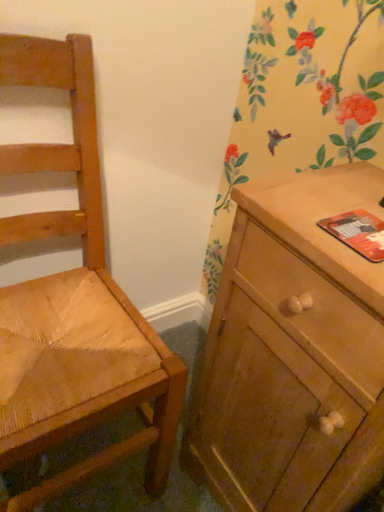
Question: Is orange matte paperback book at right directly adjacent to light brown woven wood chair at left?

Choices:
 (A) yes
 (B) no

Answer: (B)

Question: Does orange matte paperback book at right turn towards light brown woven wood chair at left?

Choices:
 (A) no
 (B) yes

Answer: (A)

Question: Can you confirm if orange matte paperback book at right is positioned to the left of light brown woven wood chair at left?

Choices:
 (A) no
 (B) yes

Answer: (A)

Question: Does orange matte paperback book at right have a greater height compared to light brown woven wood chair at left?

Choices:
 (A) no
 (B) yes

Answer: (A)

Question: Is orange matte paperback book at right not near light brown woven wood chair at left?

Choices:
 (A) no
 (B) yes

Answer: (A)

Question: Looking at their shapes, would you say wooden cabinet at right is wider or thinner than light brown woven wood chair at left?

Choices:
 (A) wide
 (B) thin

Answer: (B)

Question: Considering the relative positions of wooden cabinet at right and light brown woven wood chair at left in the image provided, is wooden cabinet at right to the left or to the right of light brown woven wood chair at left?

Choices:
 (A) left
 (B) right

Answer: (B)

Question: In terms of height, does wooden cabinet at right look taller or shorter compared to light brown woven wood chair at left?

Choices:
 (A) short
 (B) tall

Answer: (A)

Question: Does point (342, 453) appear closer or farther from the camera than point (100, 207)?

Choices:
 (A) farther
 (B) closer

Answer: (B)

Question: Is light brown woven wood chair at left wider or thinner than orange matte paperback book at right?

Choices:
 (A) thin
 (B) wide

Answer: (B)

Question: From a real-world perspective, is light brown woven wood chair at left physically located above or below orange matte paperback book at right?

Choices:
 (A) above
 (B) below

Answer: (B)

Question: Which is correct: light brown woven wood chair at left is inside orange matte paperback book at right, or outside of it?

Choices:
 (A) inside
 (B) outside

Answer: (B)

Question: Relative to orange matte paperback book at right, is light brown woven wood chair at left in front or behind?

Choices:
 (A) front
 (B) behind

Answer: (A)

Question: From the image's perspective, is light brown woven wood chair at left located above or below wooden cabinet at right?

Choices:
 (A) above
 (B) below

Answer: (A)

Question: Visually, is light brown woven wood chair at left positioned to the left or to the right of wooden cabinet at right?

Choices:
 (A) right
 (B) left

Answer: (B)